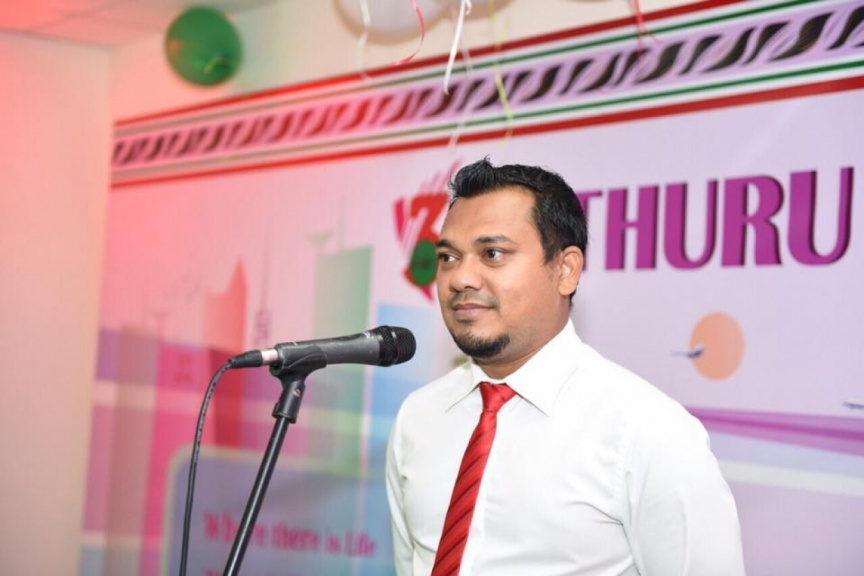
Where is `cable`? cable is located at coordinates (195, 456).